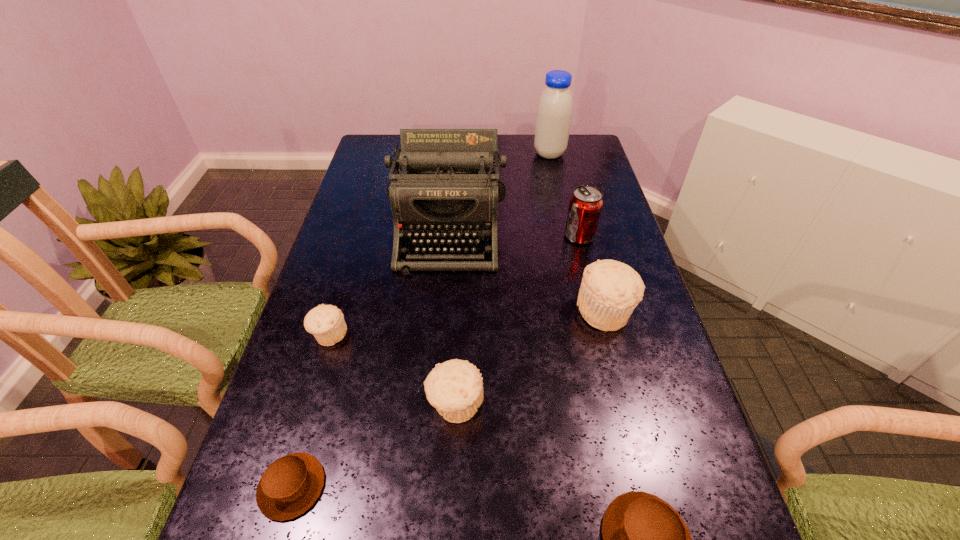
Select which brown muffin is the closest to the tallest muffin. Please provide its 2D coordinates. Your answer should be formatted as a tuple, i.e. [(x, y)], where the tuple contains the x and y coordinates of a point satisfying the conditions above.

[(645, 539)]

At what (x,y) coordinates should I click in order to perform the action: click on vacant point that satisfies the following two spatial constraints: 1. on the back side of the smaller brown muffin; 2. on the left side of the second tallest muffin. Please return your answer as a coordinate pair (x, y). Image resolution: width=960 pixels, height=540 pixels. Looking at the image, I should click on (316, 404).

Where is `vacant space that satisfies the following two spatial constraints: 1. on the front side of the rightmost beige muffin; 2. on the right side of the red pop soda`? This screenshot has width=960, height=540. vacant space that satisfies the following two spatial constraints: 1. on the front side of the rightmost beige muffin; 2. on the right side of the red pop soda is located at coordinates (598, 311).